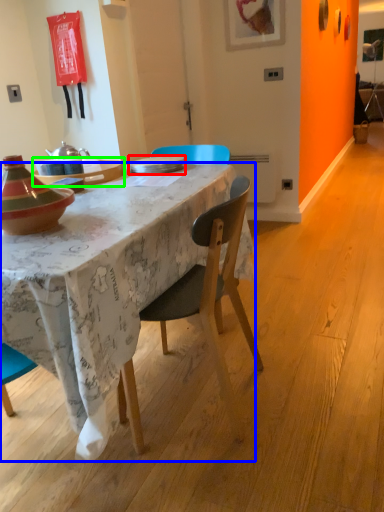
Question: Based on their relative distances, which object is farther from plate (highlighted by a red box)? Choose from desk (highlighted by a blue box) and table (highlighted by a green box).

Choices:
 (A) desk
 (B) table

Answer: (A)